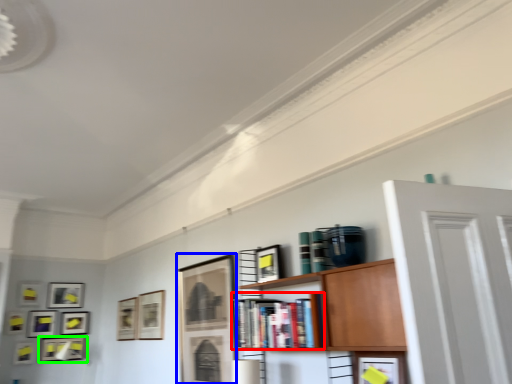
Question: Which object is positioned farthest from book (highlighted by a red box)? Select from picture frame (highlighted by a blue box) and picture frame (highlighted by a green box).

Choices:
 (A) picture frame
 (B) picture frame

Answer: (B)